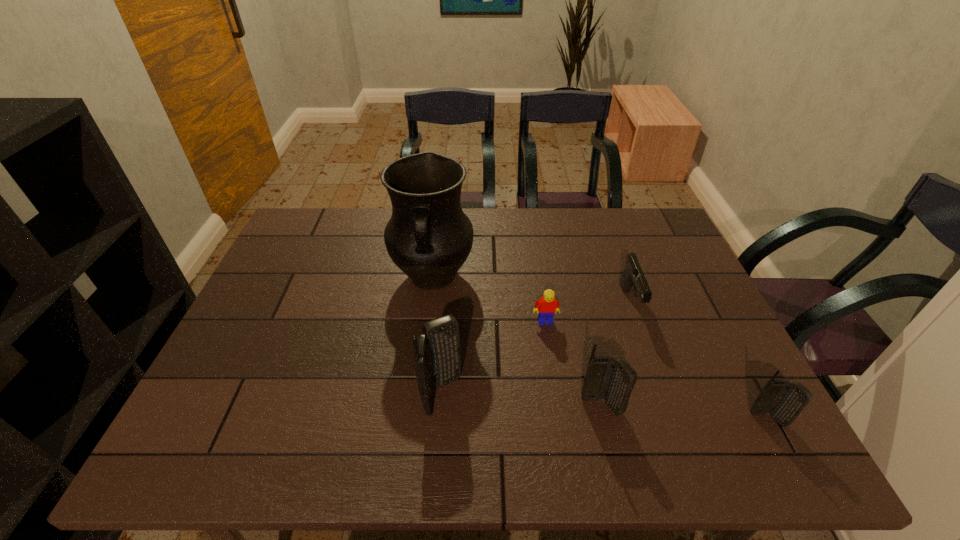
The image size is (960, 540). What are the coordinates of `the fourth closest object relative to the shortest cellular telephone` in the screenshot? It's located at (437, 355).

This screenshot has height=540, width=960. In order to click on object that is the fourth closest one to the pistol in this screenshot , I will do `click(429, 237)`.

Choose which cellular telephone is the second nearest neighbor to the second tallest object. Please provide its 2D coordinates. Your answer should be formatted as a tuple, i.e. [(x, y)], where the tuple contains the x and y coordinates of a point satisfying the conditions above.

[(784, 400)]

Identify which cellular telephone is the closest to the rightmost object. Please provide its 2D coordinates. Your answer should be formatted as a tuple, i.e. [(x, y)], where the tuple contains the x and y coordinates of a point satisfying the conditions above.

[(614, 381)]